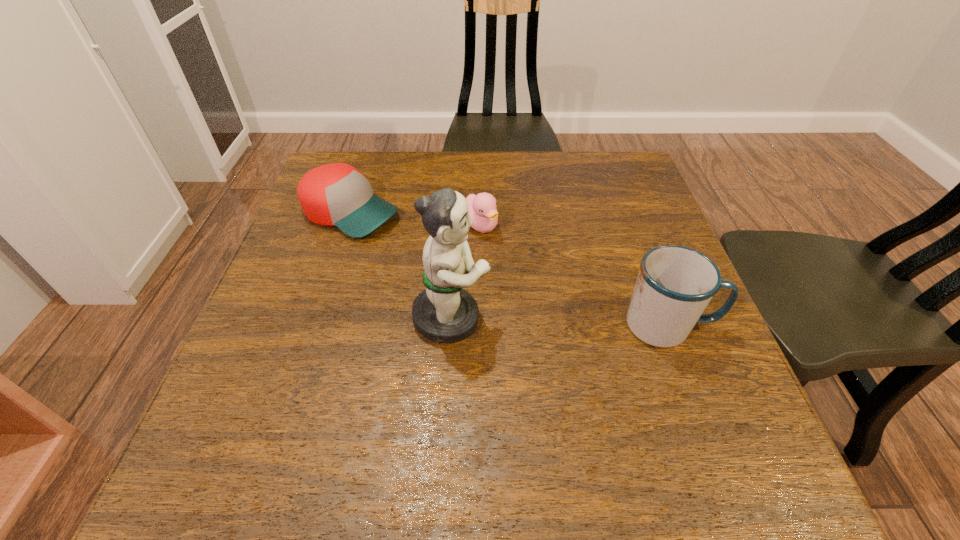
Identify the location of the tallest object. The height and width of the screenshot is (540, 960). (444, 312).

Find the location of a particular element. the second tallest object is located at coordinates (675, 284).

Find the location of a particular element. mug is located at coordinates (675, 284).

Where is `the leftmost object`? the leftmost object is located at coordinates (337, 194).

Identify the location of duckling. The width and height of the screenshot is (960, 540). (482, 209).

At what (x,y) coordinates should I click in order to perform the action: click on vacant space located on the front-facing side of the tallest object. Please return your answer as a coordinate pair (x, y). The width and height of the screenshot is (960, 540). Looking at the image, I should click on (565, 318).

Locate an element on the screen. This screenshot has height=540, width=960. vacant space located at the brim of the leftmost object is located at coordinates (529, 292).

Locate an element on the screen. vacant space located at the brim of the leftmost object is located at coordinates (457, 260).

Where is `vacant space located at the brim of the leftmost object`? The image size is (960, 540). vacant space located at the brim of the leftmost object is located at coordinates (537, 296).

Image resolution: width=960 pixels, height=540 pixels. What are the coordinates of `vacant space located 0.110m on the front-facing side of the duckling` in the screenshot? It's located at (520, 265).